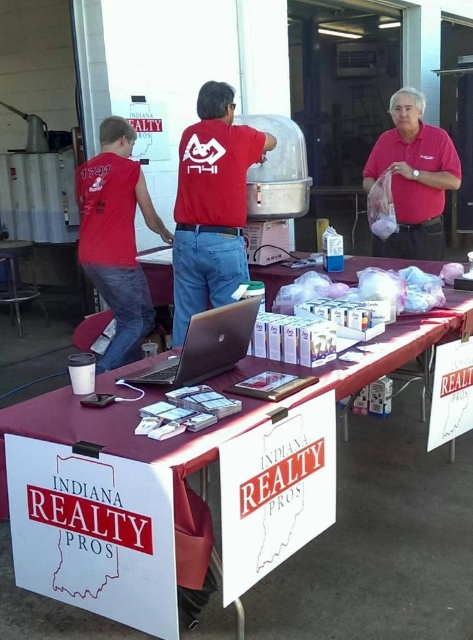
Question: Among these objects, which one is farthest from the camera?

Choices:
 (A) silver metallic laptop at center
 (B) matte red shirt at center

Answer: (B)

Question: Can you confirm if matte red shirt at upper right is bigger than silver metallic laptop at center?

Choices:
 (A) yes
 (B) no

Answer: (A)

Question: Among these points, which one is farthest from the camera?

Choices:
 (A) (439, 168)
 (B) (455, 554)
 (C) (175, 364)
 (D) (193, 209)

Answer: (A)

Question: Can you confirm if matte red shirt at center is bigger than matte red shirt at left?

Choices:
 (A) yes
 (B) no

Answer: (B)

Question: Among these objects, which one is farthest from the camera?

Choices:
 (A) maroon fabric table at center
 (B) matte red shirt at center
 (C) silver metallic laptop at center

Answer: (B)

Question: From the image, what is the correct spatial relationship of matte red shirt at center in relation to matte red shirt at left?

Choices:
 (A) right
 (B) left

Answer: (A)